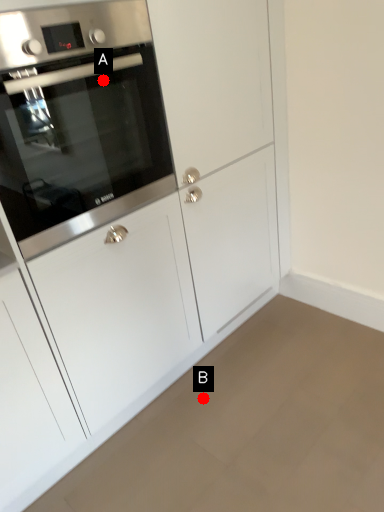
Question: Two points are circled on the image, labeled by A and B beside each circle. Which point is farther to the camera?

Choices:
 (A) A is further
 (B) B is further

Answer: (B)